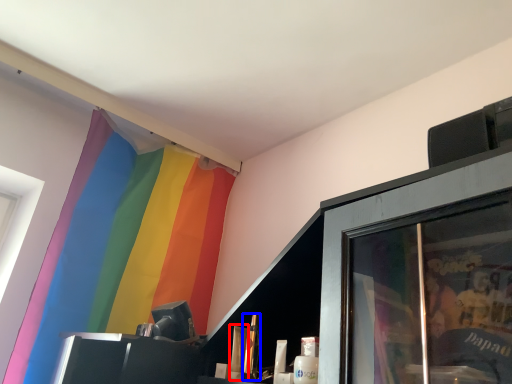
Question: Among these objects, which one is farthest to the camera, toiletry (highlighted by a red box) or toiletry (highlighted by a blue box)?

Choices:
 (A) toiletry
 (B) toiletry

Answer: (A)